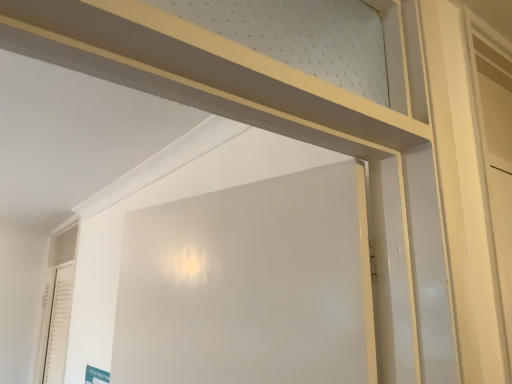
Locate an element on the screen. The image size is (512, 384). white wooden window at lower left is located at coordinates (57, 307).

The width and height of the screenshot is (512, 384). What do you see at coordinates (57, 307) in the screenshot?
I see `white wooden window at lower left` at bounding box center [57, 307].

Find the location of a particular element. white wooden window at lower left is located at coordinates (57, 307).